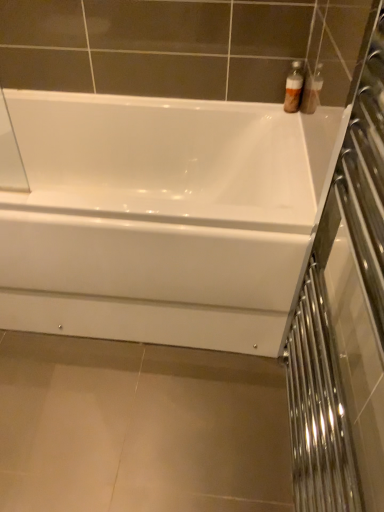
The width and height of the screenshot is (384, 512). What do you see at coordinates (344, 320) in the screenshot?
I see `clear glass screen door at right` at bounding box center [344, 320].

What do you see at coordinates (161, 218) in the screenshot? I see `white glossy bathtub at center` at bounding box center [161, 218].

At what (x,y) coordinates should I click in order to perform the action: click on translucent plastic bottles at upper right. Please return your answer as a coordinate pair (x, y). Looking at the image, I should click on (294, 87).

You are a GUI agent. You are given a task and a screenshot of the screen. Output one action in this format:
    pyautogui.click(x=<x>, y=<y>)
    Task: Click on the clear glass screen door at right
    The width and height of the screenshot is (384, 512).
    Given the screenshot: What is the action you would take?
    pyautogui.click(x=344, y=320)

Is white glossy bathtub at center oriented towards translucent plastic bottles at upper right?

No, white glossy bathtub at center is not turned towards translucent plastic bottles at upper right.

Is white glossy bathtub at center taller than translucent plastic bottles at upper right?

Indeed, white glossy bathtub at center has a greater height compared to translucent plastic bottles at upper right.

Visually, is white glossy bathtub at center positioned to the left or to the right of translucent plastic bottles at upper right?

From the image, it's evident that white glossy bathtub at center is to the left of translucent plastic bottles at upper right.

Is white glossy bathtub at center far away from translucent plastic bottles at upper right?

No, there isn't a large distance between white glossy bathtub at center and translucent plastic bottles at upper right.

Which is farther from the camera, (199, 170) or (374, 5)?

The point (199, 170) is farther from the camera.

From the image's perspective, between white glossy bathtub at center and clear glass screen door at right, which one is located above?

white glossy bathtub at center, from the image's perspective.

Is white glossy bathtub at center next to clear glass screen door at right and touching it?

They are not placed beside each other.

Is white glossy bathtub at center taller than clear glass screen door at right?

In fact, white glossy bathtub at center may be shorter than clear glass screen door at right.

Is clear glass screen door at right far away from translucent plastic bottles at upper right?

No.

Where is `toiletry on the right side of clear glass screen door at right`? toiletry on the right side of clear glass screen door at right is located at coordinates (294, 87).

Considering the sizes of objects clear glass screen door at right and translucent plastic bottles at upper right in the image provided, who is bigger, clear glass screen door at right or translucent plastic bottles at upper right?

With larger size is clear glass screen door at right.

From the picture: In terms of height, does clear glass screen door at right look taller or shorter compared to translucent plastic bottles at upper right?

Considering their sizes, clear glass screen door at right has more height than translucent plastic bottles at upper right.

Which object is further away from the camera taking this photo, translucent plastic bottles at upper right or clear glass screen door at right?

translucent plastic bottles at upper right is further away from the camera.

Considering the relative sizes of translucent plastic bottles at upper right and clear glass screen door at right in the image provided, is translucent plastic bottles at upper right taller than clear glass screen door at right?

No.

Find the location of a particular element. screen door in front of the translucent plastic bottles at upper right is located at coordinates (344, 320).

Between translucent plastic bottles at upper right and white glossy bathtub at center, which one is positioned in front?

white glossy bathtub at center.

Does translucent plastic bottles at upper right appear on the right side of white glossy bathtub at center?

Yes, translucent plastic bottles at upper right is to the right of white glossy bathtub at center.

How different are the orientations of translucent plastic bottles at upper right and white glossy bathtub at center in degrees?

0.0032 degrees separate the facing orientations of translucent plastic bottles at upper right and white glossy bathtub at center.

Locate an element on the screen. This screenshot has width=384, height=512. bathtub that is in front of the translucent plastic bottles at upper right is located at coordinates (161, 218).

Which of these two, clear glass screen door at right or white glossy bathtub at center, stands shorter?

white glossy bathtub at center is shorter.

From the image's perspective, is clear glass screen door at right under white glossy bathtub at center?

Yes, from the image's perspective, clear glass screen door at right is beneath white glossy bathtub at center.

Where is `bathtub on the left of clear glass screen door at right`? This screenshot has width=384, height=512. bathtub on the left of clear glass screen door at right is located at coordinates (161, 218).

Identify the location of bathtub in front of the translucent plastic bottles at upper right. (161, 218).

At what (x,y) coordinates should I click in order to perform the action: click on screen door on the right of white glossy bathtub at center. Please return your answer as a coordinate pair (x, y). Looking at the image, I should click on (344, 320).

When comparing their distances from clear glass screen door at right, does translucent plastic bottles at upper right or white glossy bathtub at center seem closer?

white glossy bathtub at center lies closer to clear glass screen door at right than the other object.

Considering their positions, is clear glass screen door at right positioned further to white glossy bathtub at center than translucent plastic bottles at upper right?

translucent plastic bottles at upper right.

Which object lies further to the anchor point translucent plastic bottles at upper right, clear glass screen door at right or white glossy bathtub at center?

clear glass screen door at right is further to translucent plastic bottles at upper right.

From the picture: Based on their spatial positions, is white glossy bathtub at center or clear glass screen door at right further from translucent plastic bottles at upper right?

clear glass screen door at right lies further to translucent plastic bottles at upper right than the other object.

From the image, which object appears to be farther from clear glass screen door at right, white glossy bathtub at center or translucent plastic bottles at upper right?

translucent plastic bottles at upper right is further to clear glass screen door at right.

When comparing their distances from white glossy bathtub at center, does translucent plastic bottles at upper right or clear glass screen door at right seem further?

The object further to white glossy bathtub at center is translucent plastic bottles at upper right.

Where is `bathtub between clear glass screen door at right and translucent plastic bottles at upper right along the z-axis`? bathtub between clear glass screen door at right and translucent plastic bottles at upper right along the z-axis is located at coordinates (161, 218).